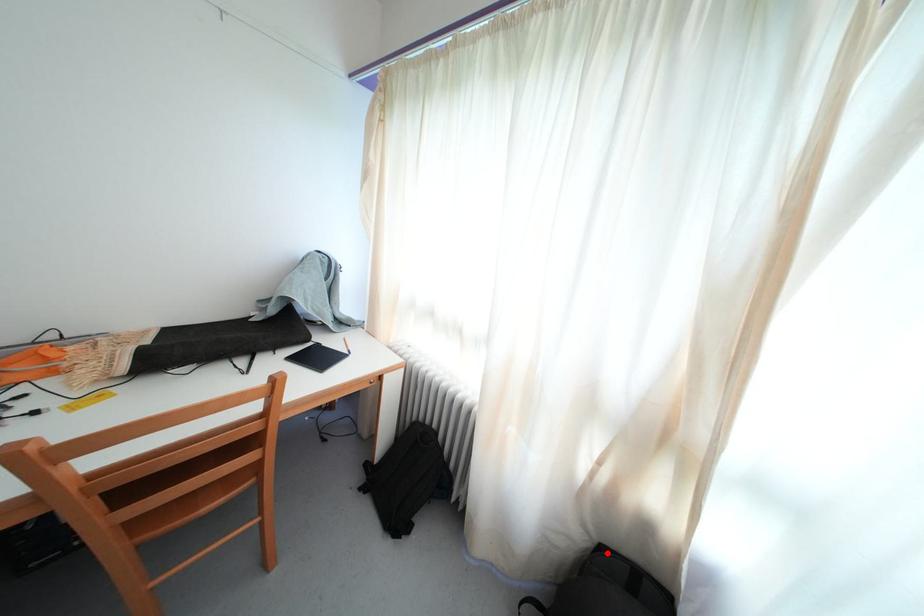
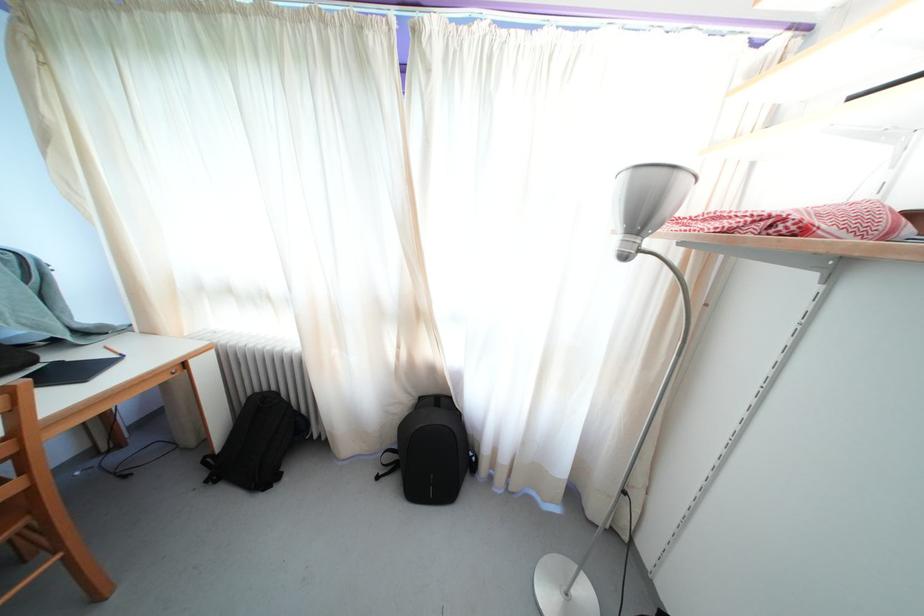
Find the pixel in the second image that matches the highlighted location in the first image.

(427, 405)